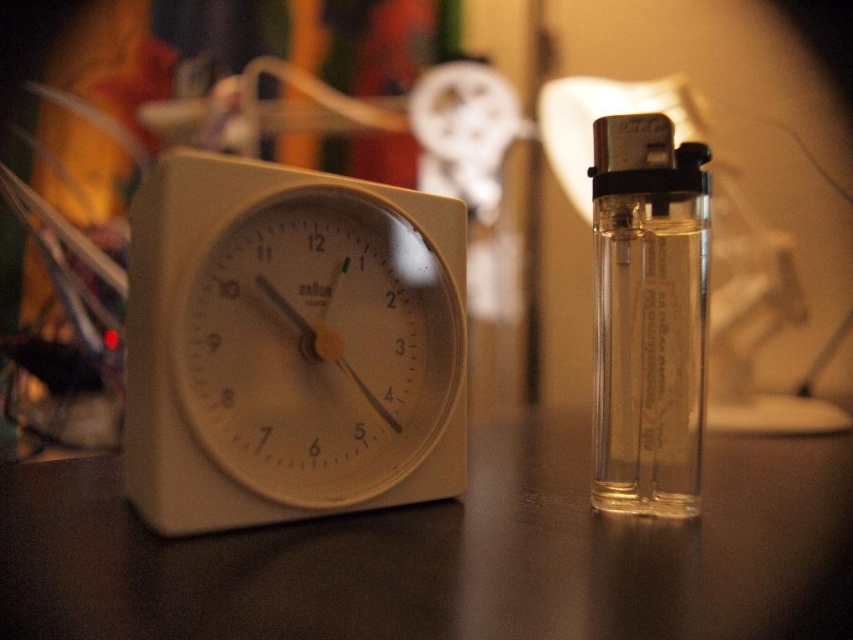
Question: Which point is farther from the camera taking this photo?

Choices:
 (A) (148, 324)
 (B) (30, 504)
 (C) (627, 477)

Answer: (C)

Question: Based on their relative distances, which object is nearer to the clear glass lighter at right?

Choices:
 (A) white plastic clock at left
 (B) matte white clock at left

Answer: (B)

Question: Is white plastic clock at left closer to camera compared to clear glass lighter at right?

Choices:
 (A) yes
 (B) no

Answer: (A)

Question: Can you confirm if matte white clock at left is bigger than clear glass lighter at right?

Choices:
 (A) no
 (B) yes

Answer: (B)

Question: Which of the following is the closest to the observer?

Choices:
 (A) (375, 300)
 (B) (630, 298)

Answer: (B)

Question: Does matte white clock at left appear under clear glass lighter at right?

Choices:
 (A) yes
 (B) no

Answer: (A)